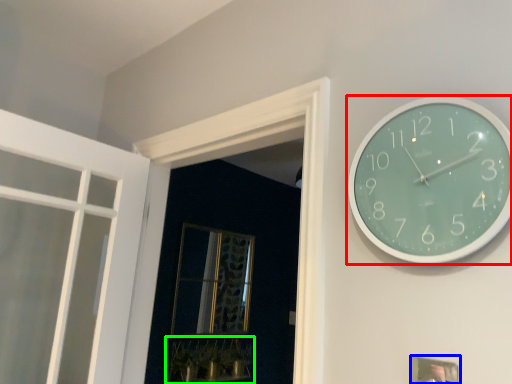
Question: Considering the real-world distances, which object is closest to wall clock (highlighted by a red box)? picture frame (highlighted by a blue box) or plant (highlighted by a green box).

Choices:
 (A) picture frame
 (B) plant

Answer: (A)